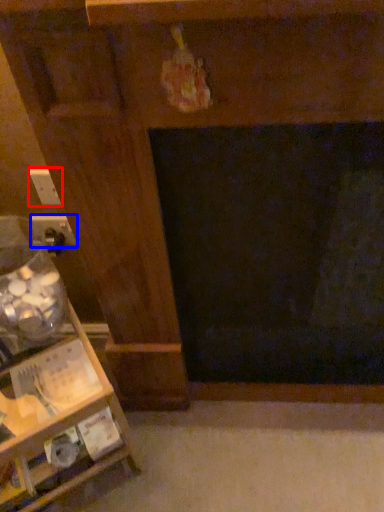
Question: Which point is further to the camera, electric outlet (highlighted by a red box) or electric outlet (highlighted by a blue box)?

Choices:
 (A) electric outlet
 (B) electric outlet

Answer: (B)